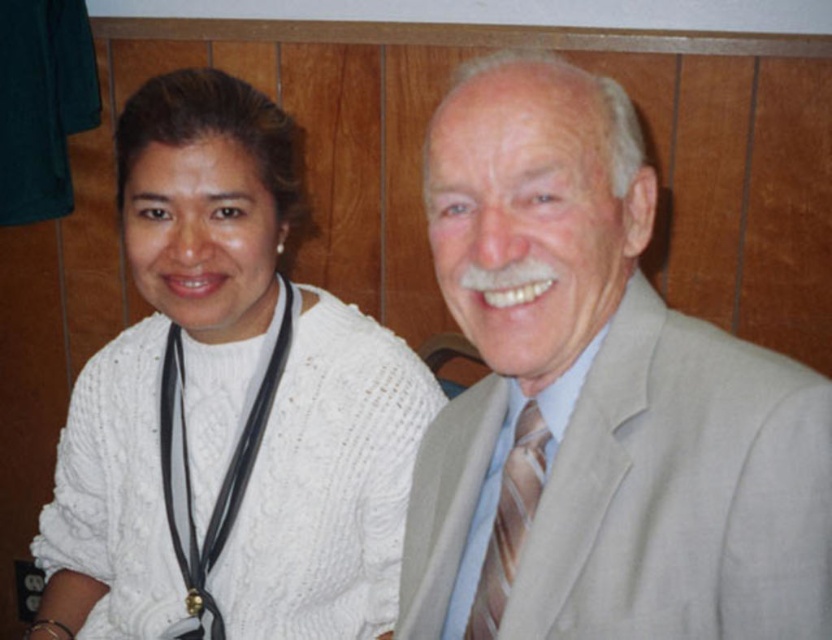
You are a photographer adjusting your camera settings to focus on the light beige suit at center and the brown striped tie at center. Which one is closer to the camera?

The light beige suit at center is closer to the camera than the brown striped tie at center because it is in front of it.

You are standing in front of the image and want to locate the light beige suit at center. According to the coordinates provided, where would you find it?

The light beige suit at center is located at point coordinates of 0.627 on the x axis and 0.719 on the y axis.

You are a photographer setting up a portrait shoot. You notice the white knitted sweater at left and the black leather stethoscope at left in the frame. Which object should you adjust to ensure both are clearly visible?

The white knitted sweater at left is larger in size than the black leather stethoscope at left, so you should adjust the white knitted sweater at left to ensure both are clearly visible.